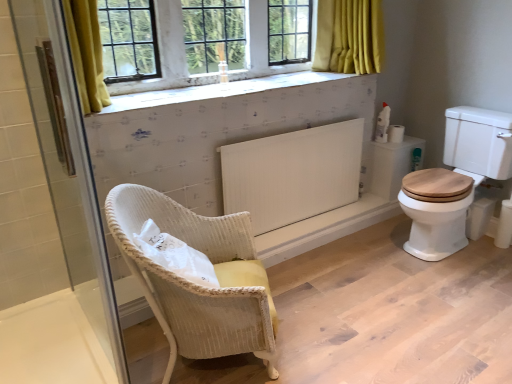
Image resolution: width=512 pixels, height=384 pixels. What are the coordinates of `vacant area that lies between white wicker rocking chair at right and woven yellow chair at center` in the screenshot? It's located at (353, 293).